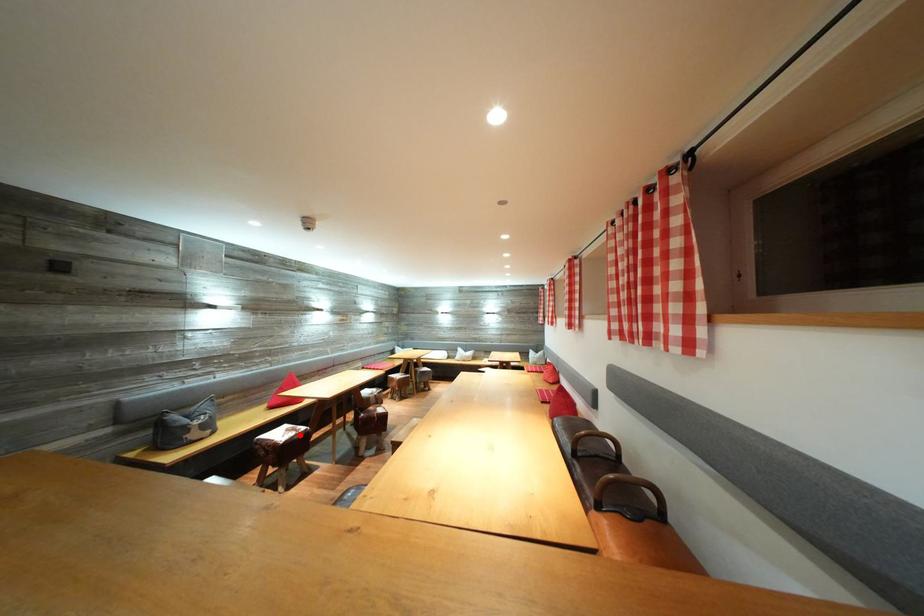
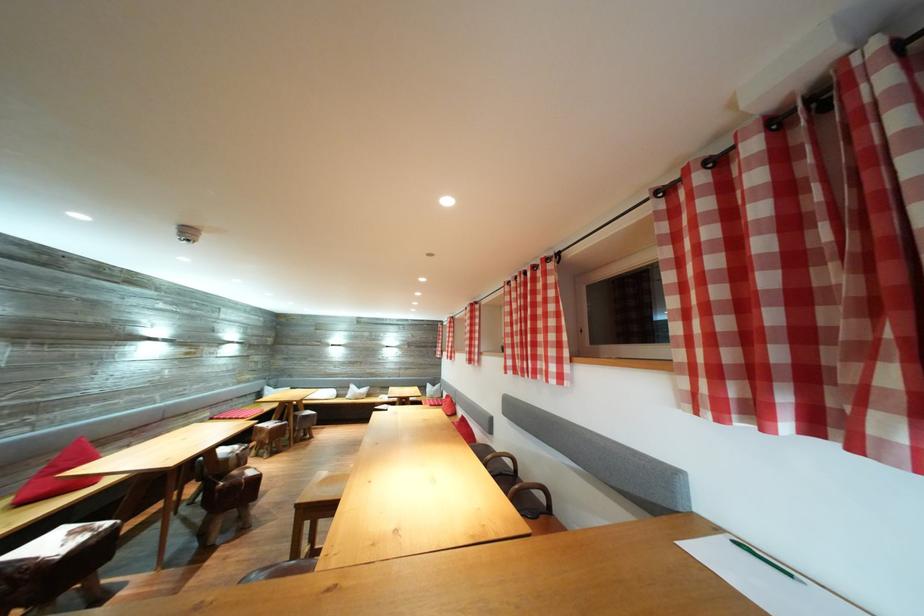
Question: I am providing you with two images of the same scene from different viewpoints. In image1, a red point is highlighted. Considering the same 3D point in image2, which of the following is correct?

Choices:
 (A) It is closer
 (B) It is farther

Answer: (B)